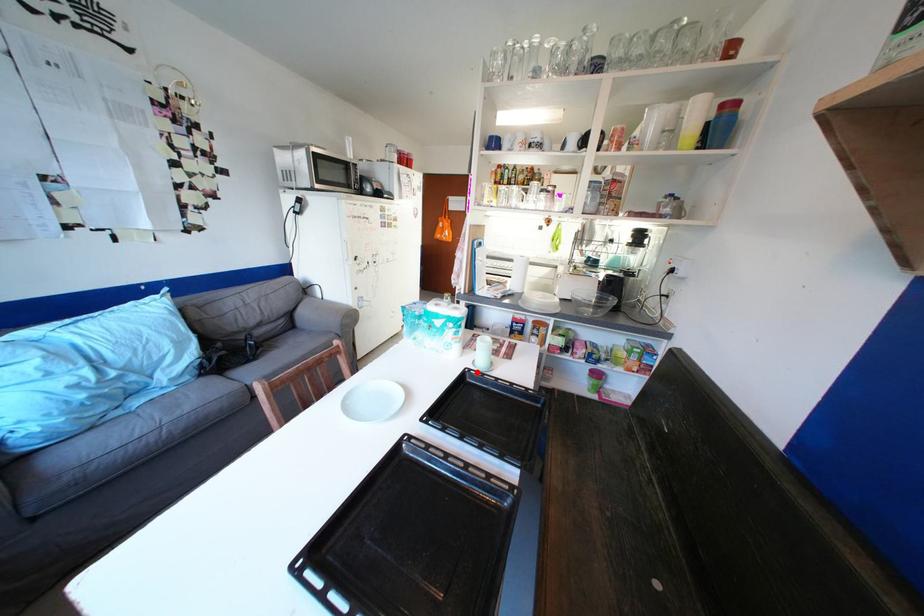
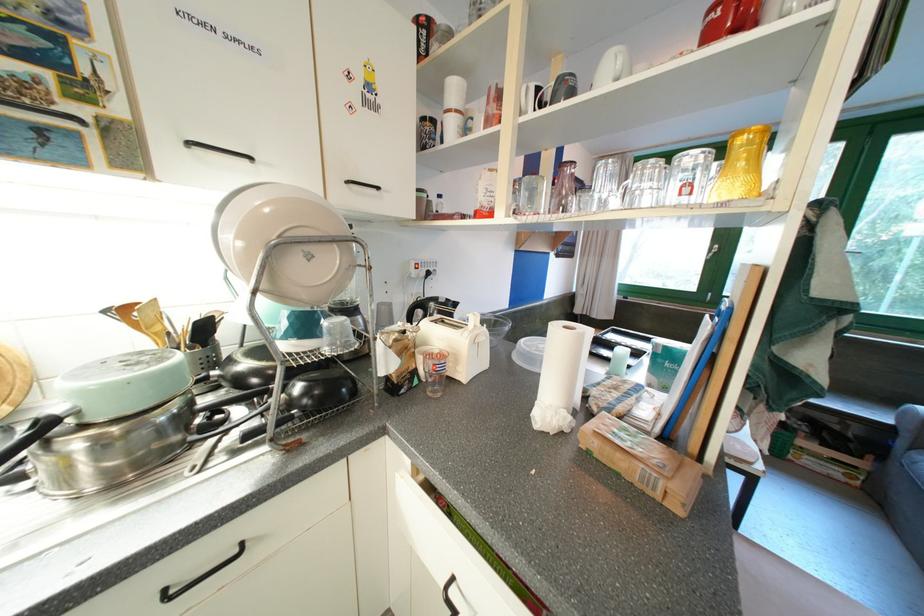
Question: I am providing you with two images of the same scene from different viewpoints. A red point is marked on the first image. At the location where the point appears in image 1, is it still visible in image 2?

Choices:
 (A) Yes
 (B) No

Answer: (B)